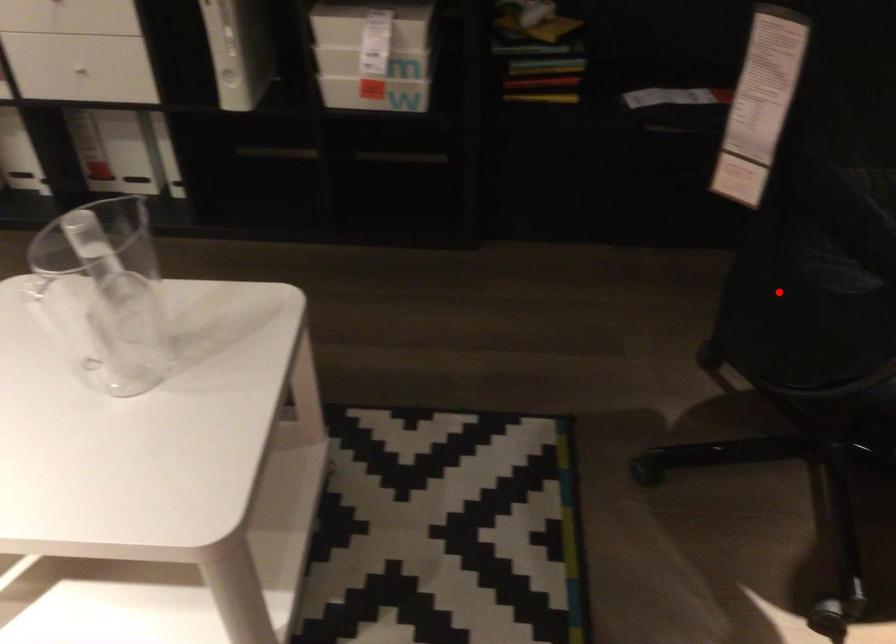
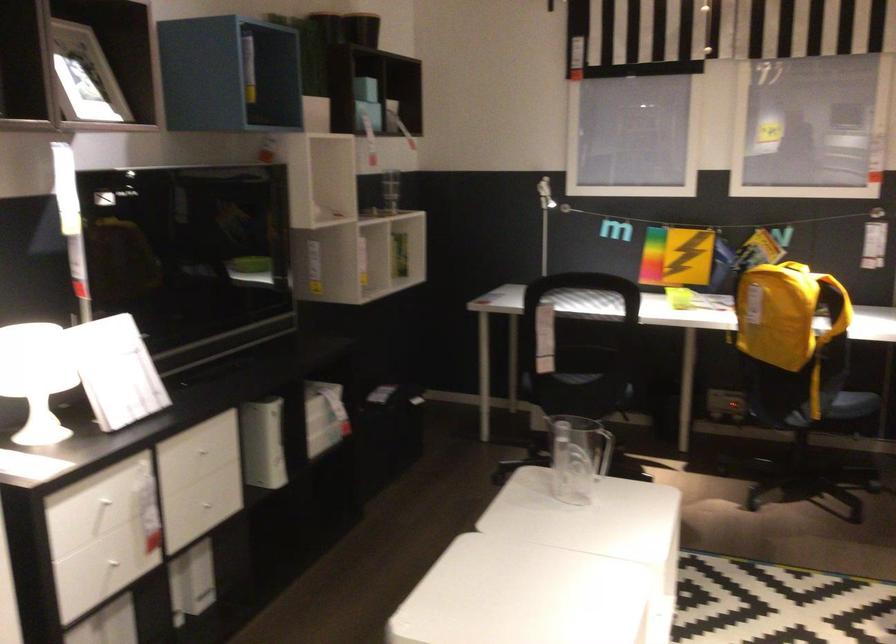
Question: A red point is marked in image1. In image2, is the corresponding 3D point closer to the camera or farther? Reply with the corresponding letter.

Choices:
 (A) The corresponding 3D point is closer.
 (B) The corresponding 3D point is farther.

Answer: (B)